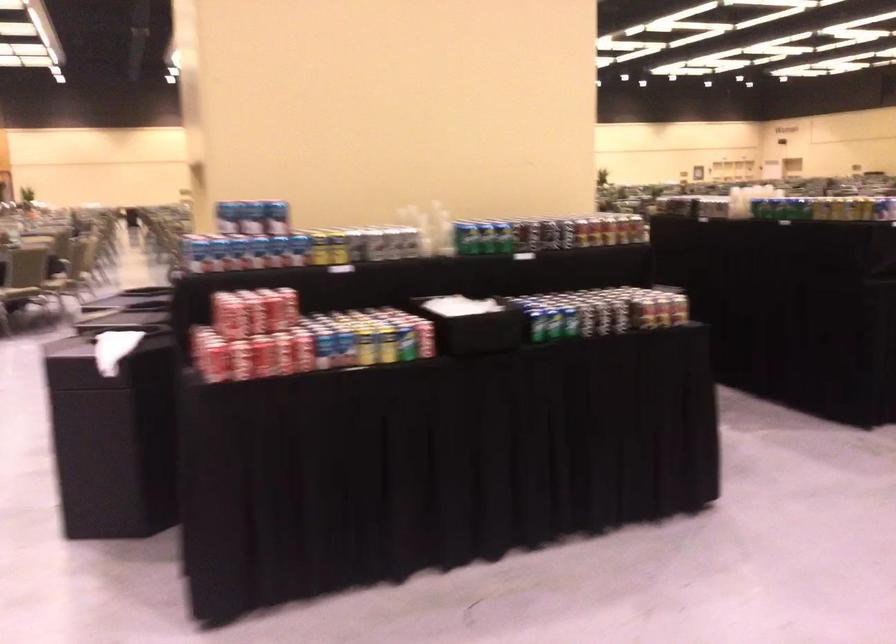
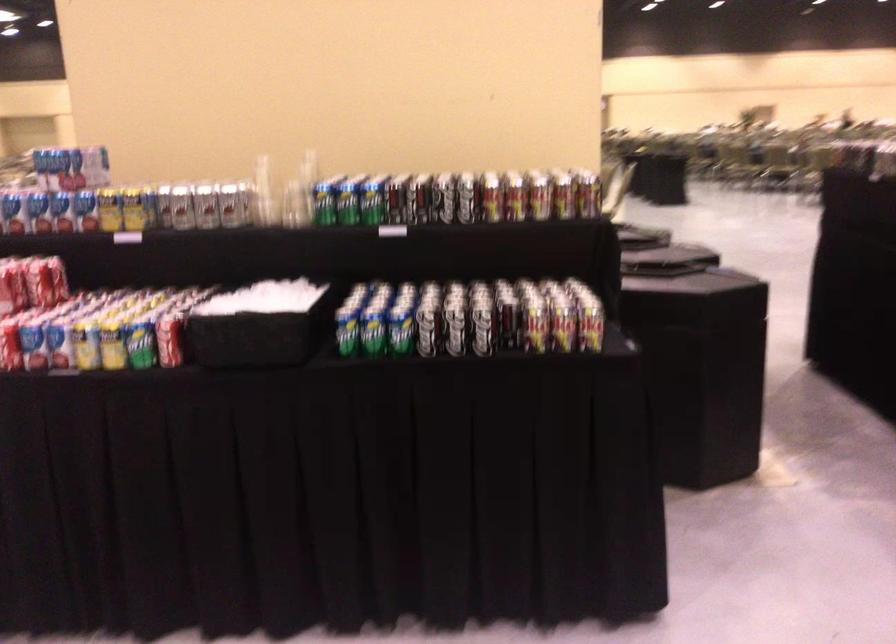
Locate, in the second image, the point that corresponds to (x=400, y=345) in the first image.

(140, 345)